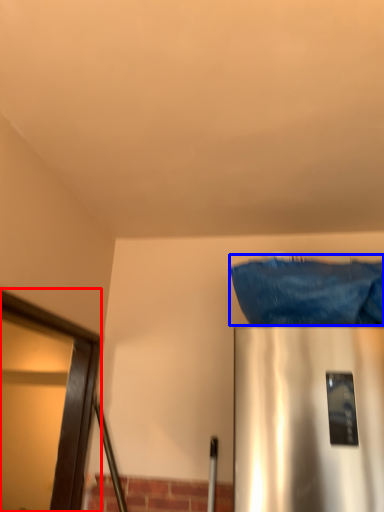
Question: Which object is closer to the camera taking this photo, glass door (highlighted by a red box) or material (highlighted by a blue box)?

Choices:
 (A) glass door
 (B) material

Answer: (A)